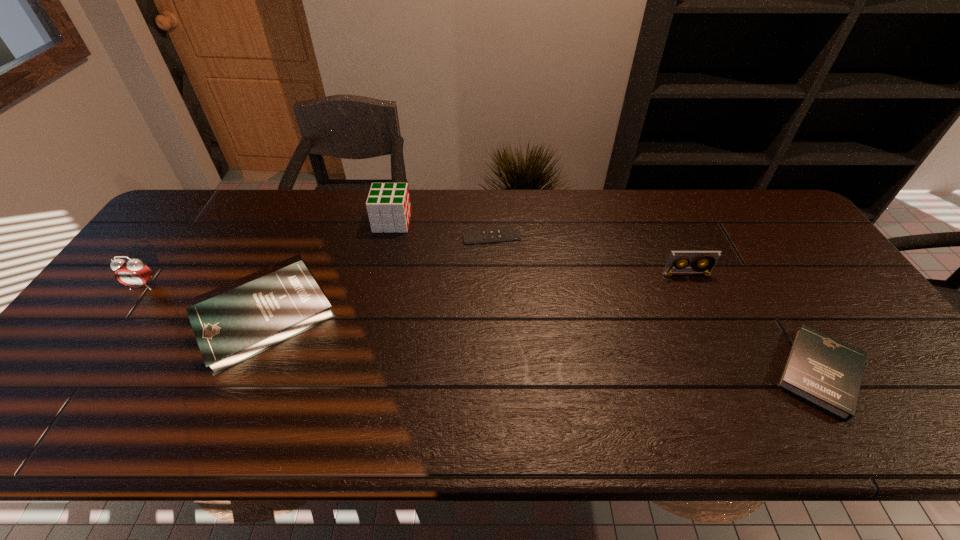
At what (x,y) coordinates should I click in order to perform the action: click on free spot that satisfies the following two spatial constraints: 1. at the front of the fifth object from left to right with visible reels; 2. on the right side of the fifth tallest object. Please return your answer as a coordinate pair (x, y). The image size is (960, 540). Looking at the image, I should click on click(732, 373).

The height and width of the screenshot is (540, 960). Identify the location of vacant area in the image that satisfies the following two spatial constraints: 1. on the back side of the rightmost object; 2. on the red face of the third object from left to right. (727, 222).

Identify the location of free region that satisfies the following two spatial constraints: 1. on the clock face of the alarm clock; 2. on the right side of the fourth tallest object. The width and height of the screenshot is (960, 540). (120, 318).

Locate an element on the screen. The width and height of the screenshot is (960, 540). free space that satisfies the following two spatial constraints: 1. on the red face of the third object from left to right; 2. on the left side of the rightmost object is located at coordinates (359, 373).

Where is `vacant space that satisfies the following two spatial constraints: 1. on the clock face of the left book; 2. on the right side of the alarm clock`? vacant space that satisfies the following two spatial constraints: 1. on the clock face of the left book; 2. on the right side of the alarm clock is located at coordinates point(120,318).